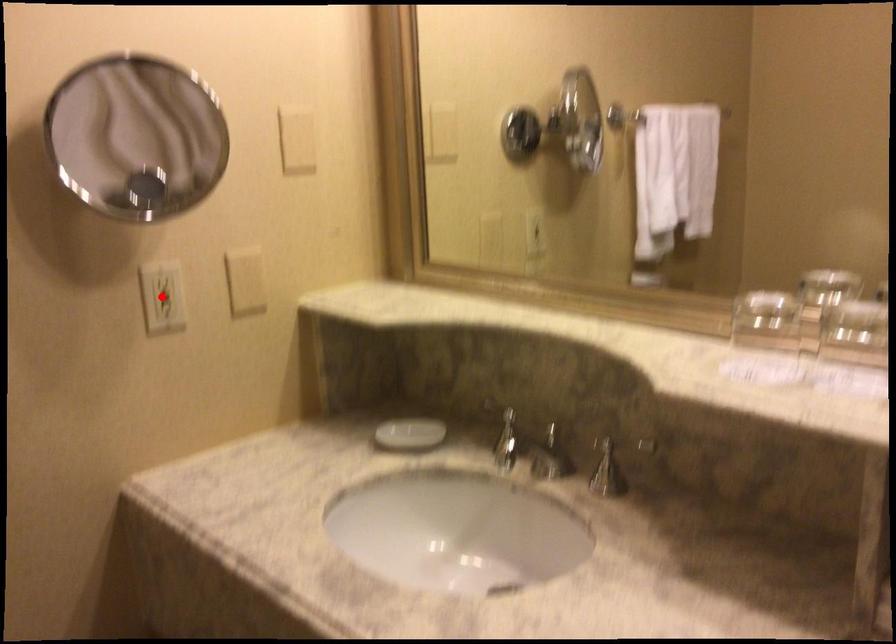
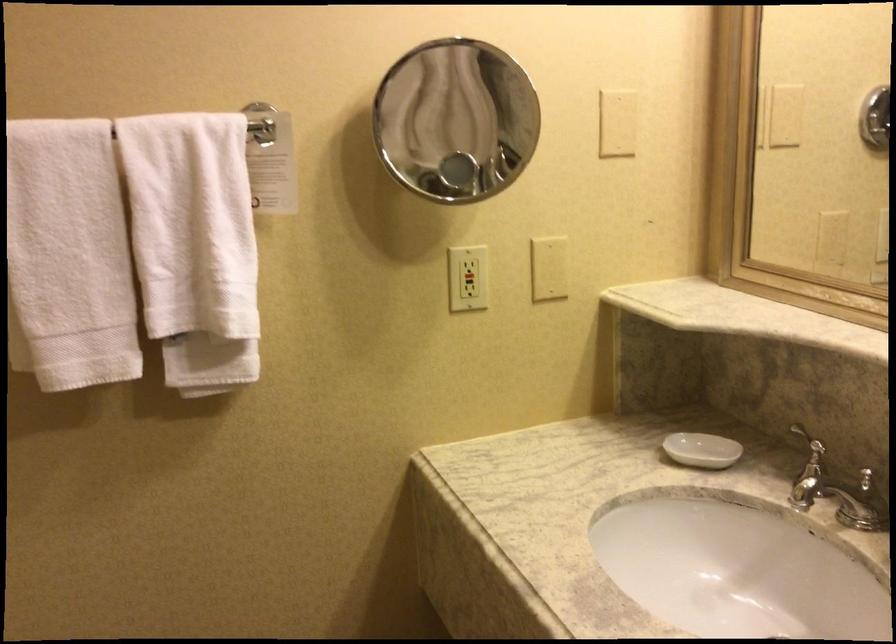
Question: I am providing you with two images of the same scene from different viewpoints. A red point is marked on the first image. At the location where the point appears in image 1, is it still visible in image 2?

Choices:
 (A) Yes
 (B) No

Answer: (A)